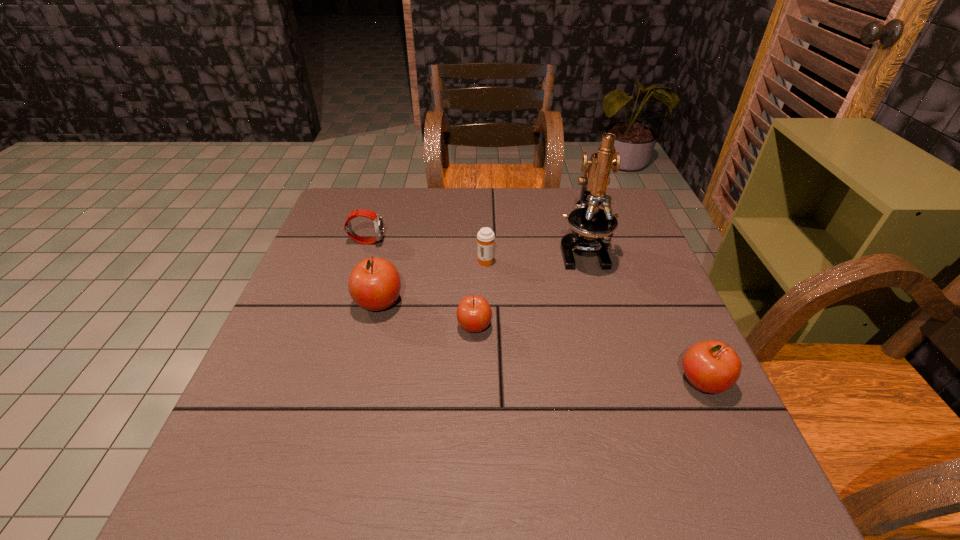
If equal spacing is the goal by inserting an additional apple among them, please point out a vacant space for this new apple. Please provide its 2D coordinates. Your answer should be formatted as a tuple, i.e. [(x, y)], where the tuple contains the x and y coordinates of a point satisfying the conditions above.

[(582, 353)]